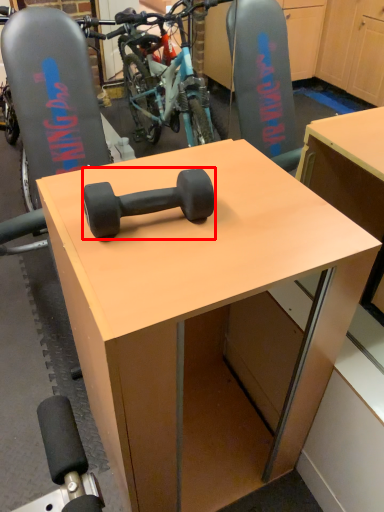
Question: Considering the relative positions of dumbbell (annotated by the red box) and desk in the image provided, where is dumbbell (annotated by the red box) located with respect to the staircase?

Choices:
 (A) left
 (B) right

Answer: (A)